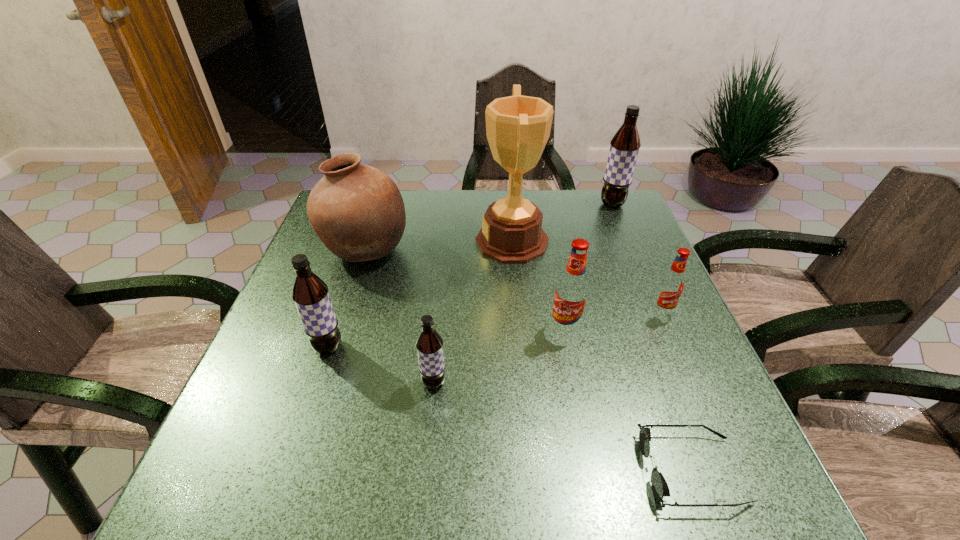
I want to click on object that ranks as the seventh closest to the smaller red root beer, so click(310, 294).

Identify the location of root beer that can be found as the second closest to the sunglasses. (670, 288).

Where is `root beer object that ranks as the second closest to the pottery`? The width and height of the screenshot is (960, 540). root beer object that ranks as the second closest to the pottery is located at coordinates (429, 343).

Identify which brown root beer is located as the second nearest to the tallest root beer. Please provide its 2D coordinates. Your answer should be formatted as a tuple, i.e. [(x, y)], where the tuple contains the x and y coordinates of a point satisfying the conditions above.

[(310, 294)]

This screenshot has width=960, height=540. Find the location of `brown root beer that stands as the closest to the bigger red root beer`. brown root beer that stands as the closest to the bigger red root beer is located at coordinates (429, 343).

In order to click on free space that satisfies the following two spatial constraints: 1. on the back side of the bigger red root beer; 2. on the front-facing side of the award in this screenshot , I will do `click(548, 241)`.